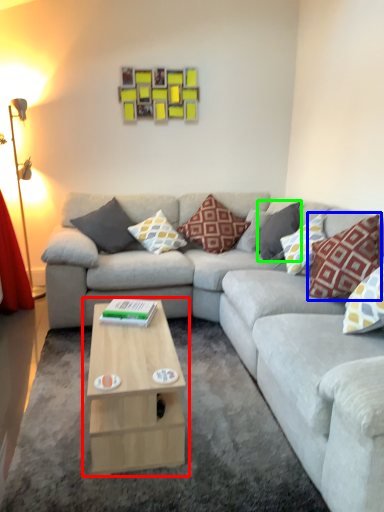
Question: Which is farther away from coffee table (highlighted by a red box)? pillow (highlighted by a blue box) or pillow (highlighted by a green box)?

Choices:
 (A) pillow
 (B) pillow

Answer: (B)